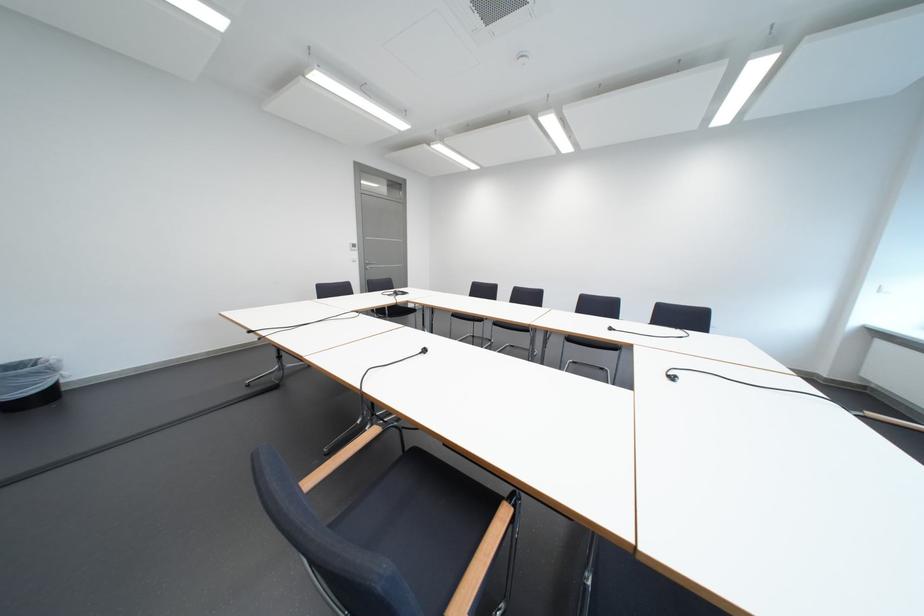
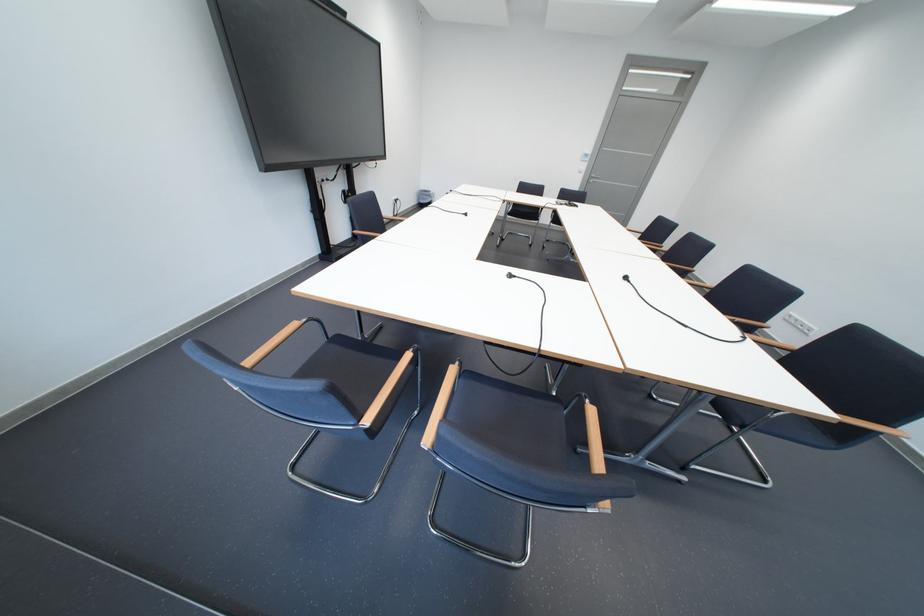
Find the pixel in the second image that matches (368,257) in the first image.

(596, 168)